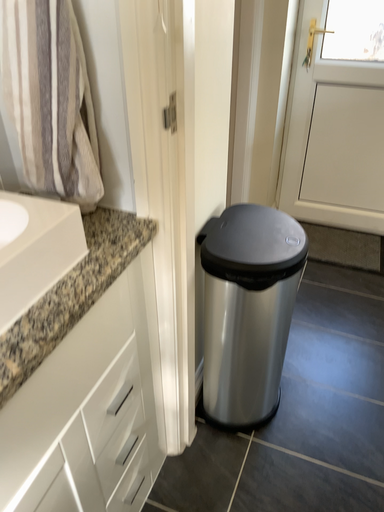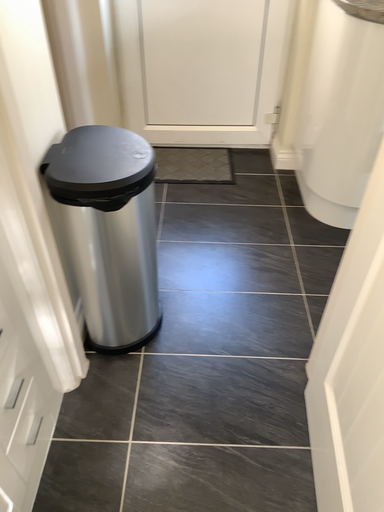
Question: Which way did the camera rotate in the video?

Choices:
 (A) rotated left
 (B) rotated right

Answer: (B)